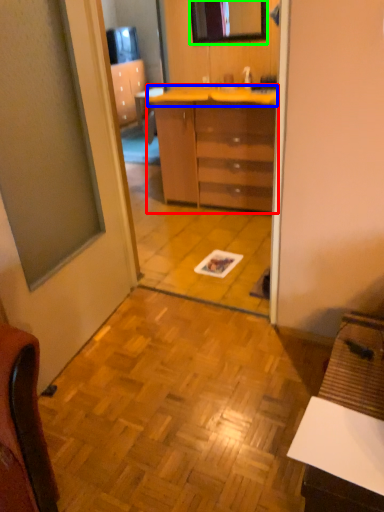
Question: Which is nearer to the chest of drawers (highlighted by a red box)? counter top (highlighted by a blue box) or mirror (highlighted by a green box).

Choices:
 (A) counter top
 (B) mirror

Answer: (A)